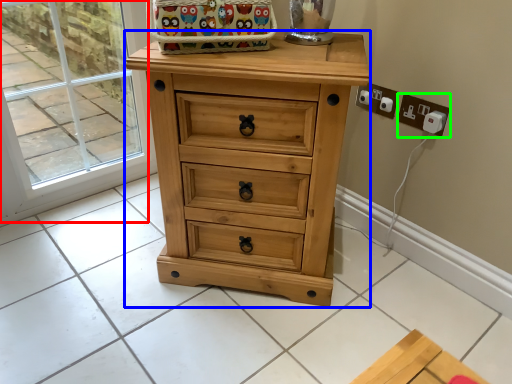
Question: Which object is positioned closest to glass door (highlighted by a red box)? Select from chest of drawers (highlighted by a blue box) and electric outlet (highlighted by a green box).

Choices:
 (A) chest of drawers
 (B) electric outlet

Answer: (A)